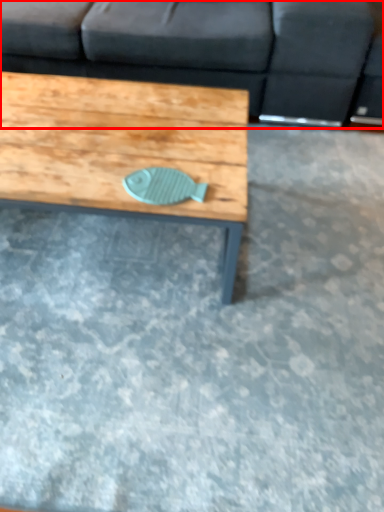
Question: From the image's perspective, where is studio couch (annotated by the red box) located in relation to coffee table in the image?

Choices:
 (A) below
 (B) above

Answer: (B)